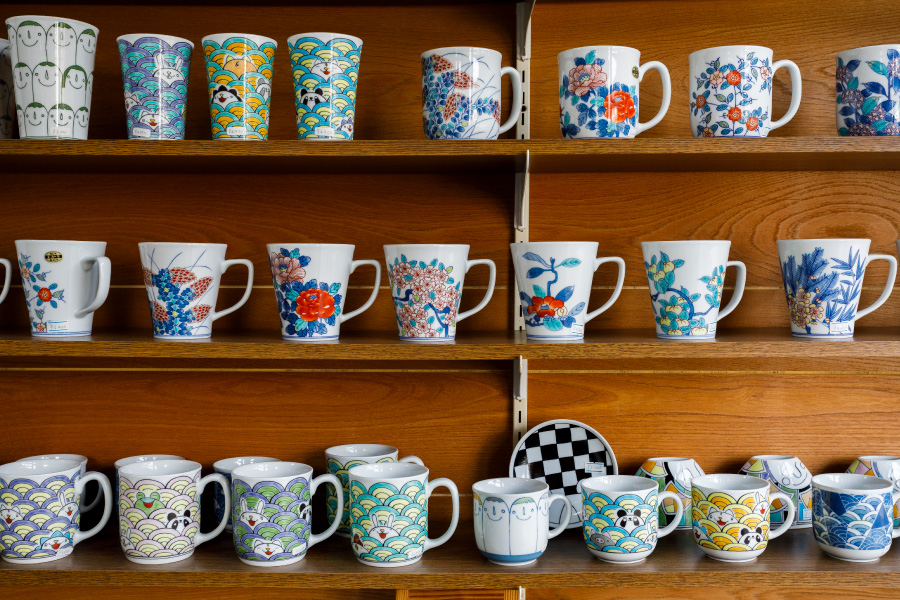
This screenshot has width=900, height=600. I want to click on cups on the middle shelf, so click(48, 289), click(160, 285), click(304, 285), click(414, 289), click(572, 279), click(691, 277), click(840, 295).